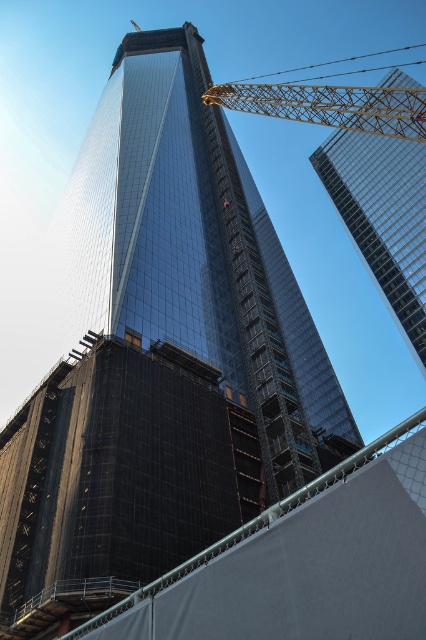
Question: Which of these objects is positioned closest to the glassy steel skyscraper at upper right?

Choices:
 (A) gold mesh crane at upper center
 (B) black mesh scaffolding at center

Answer: (A)

Question: Which object is the farthest from the gold mesh crane at upper center?

Choices:
 (A) glassy steel skyscraper at upper right
 (B) black mesh scaffolding at center

Answer: (B)

Question: Is black mesh scaffolding at center below gold mesh crane at upper center?

Choices:
 (A) no
 (B) yes

Answer: (B)

Question: Does glassy steel skyscraper at upper right have a larger size compared to gold mesh crane at upper center?

Choices:
 (A) no
 (B) yes

Answer: (A)

Question: Among these points, which one is farthest from the camera?

Choices:
 (A) (417, 508)
 (B) (324, 124)

Answer: (B)

Question: Is black mesh scaffolding at center closer to camera compared to glassy steel skyscraper at upper right?

Choices:
 (A) no
 (B) yes

Answer: (B)